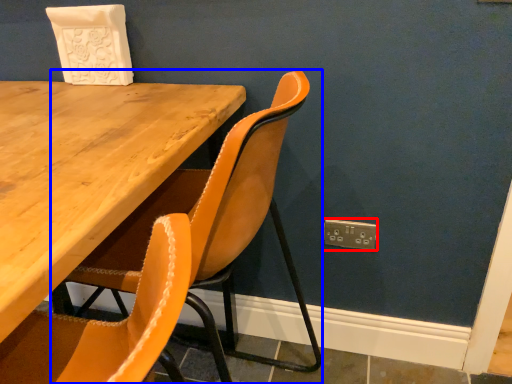
Question: Which object appears farthest to the camera in this image, electric outlet (highlighted by a red box) or chair (highlighted by a blue box)?

Choices:
 (A) electric outlet
 (B) chair

Answer: (A)